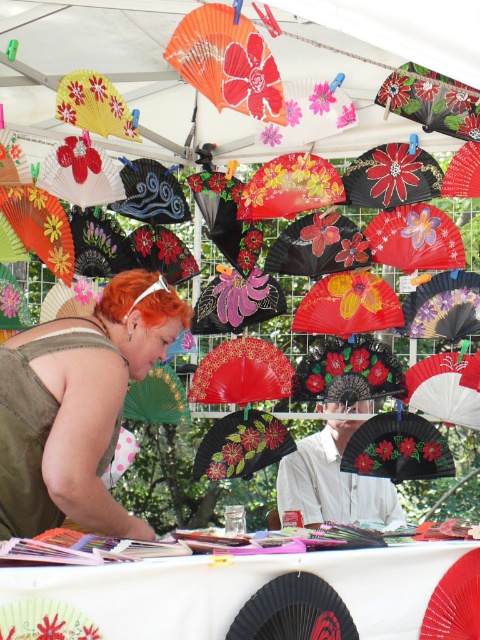
You are standing at the entrance of the tent and see the point marked at coordinates (242, 596). According to the scene, where is this point located?

The point at (242, 596) is located on the white paper table at center.

You are a customer at a craft fair and see the matte olive green tank top at center and the orange paper fan at upper center on the table. Which item has a greater width?

The matte olive green tank top at center has a greater width than the orange paper fan at upper center.